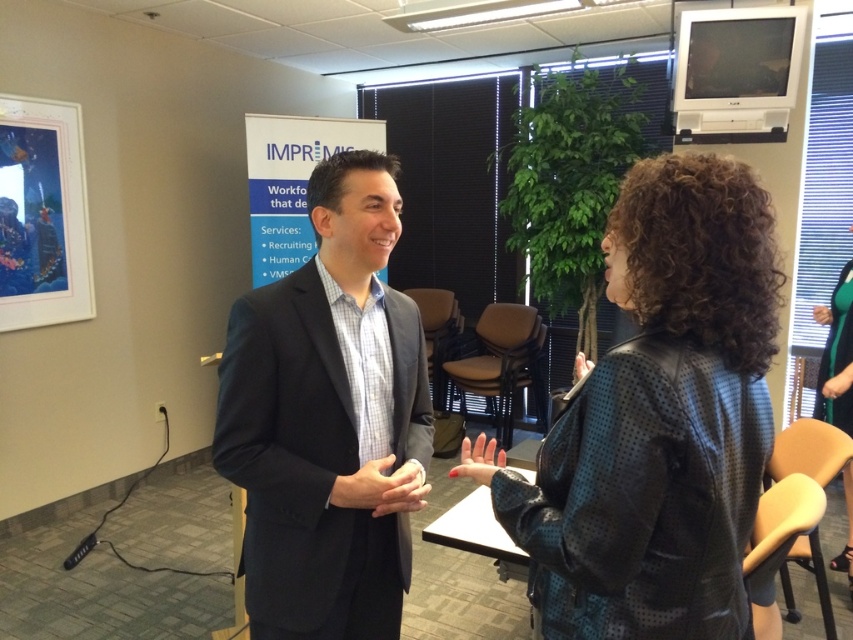
You are an office assistant who needs to hang a new poster that requires a height of 1.5 meters. Given the black leather jacket at center and the blue paper at center in the scene, which object is suitable to place the poster above without blocking the view of the other object?

The blue paper at center is taller than the black leather jacket at center, so placing the poster above the blue paper at center would ensure it reaches the required height while keeping the black leather jacket at center visible.

Consider the image. You are an office worker who needs to locate a specific point in an office scene. The point is labeled as point [328,419]. Based on the scene description, can you determine which object this point corresponds to?

The point [328,419] is on the dark blue suit at center.

You are an assistant helping to organize a charity event. You need to place a 30 cm wide donation box between the black leather jacket at center and the dark blue suit at center. Can the donation box fit in the space between them?

The black leather jacket at center is wider than the dark blue suit at center. However, the exact distance between them isn